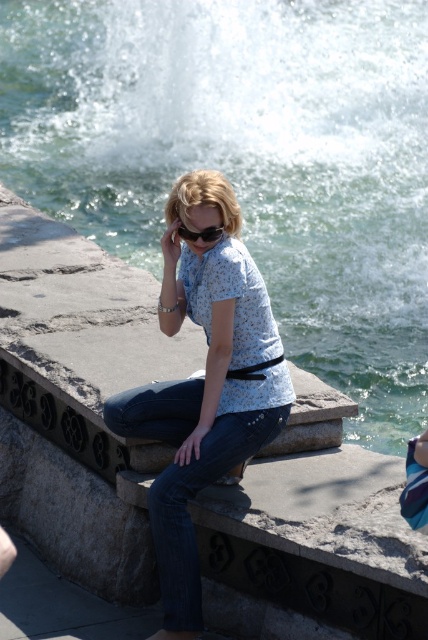
You are a swimmer preparing to enter the water and see the denim at center and the black matte goggles at center. Which item is taller?

The denim at center is taller than the black matte goggles at center.

You are a photographer trying to capture the woman in the scene. Since both the denim at center and black matte goggles at center are at the center, which object should you focus on to ensure the woman is clearly visible in your photo?

The denim at center is in front of the black matte goggles at center, so focusing on the denim at center will ensure the woman is clearly visible.